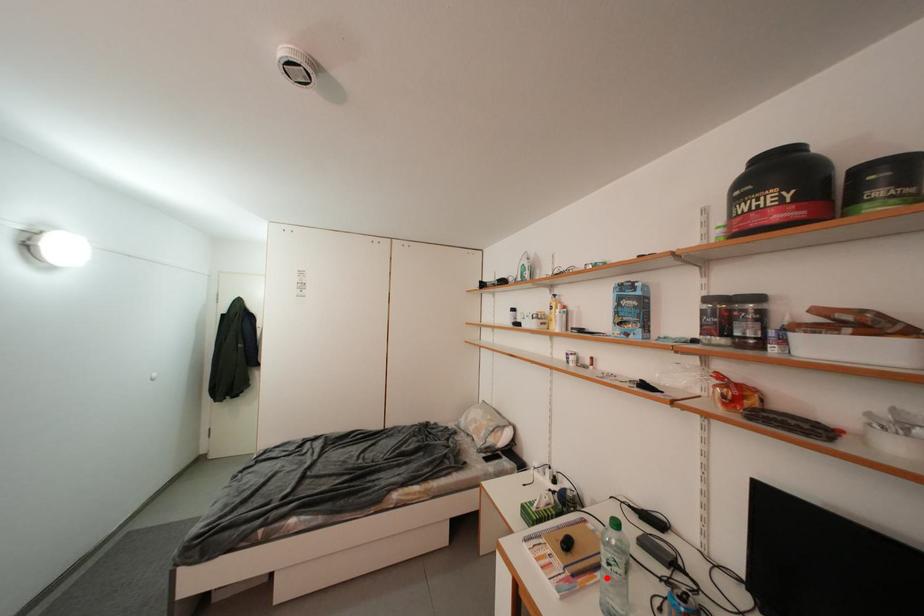
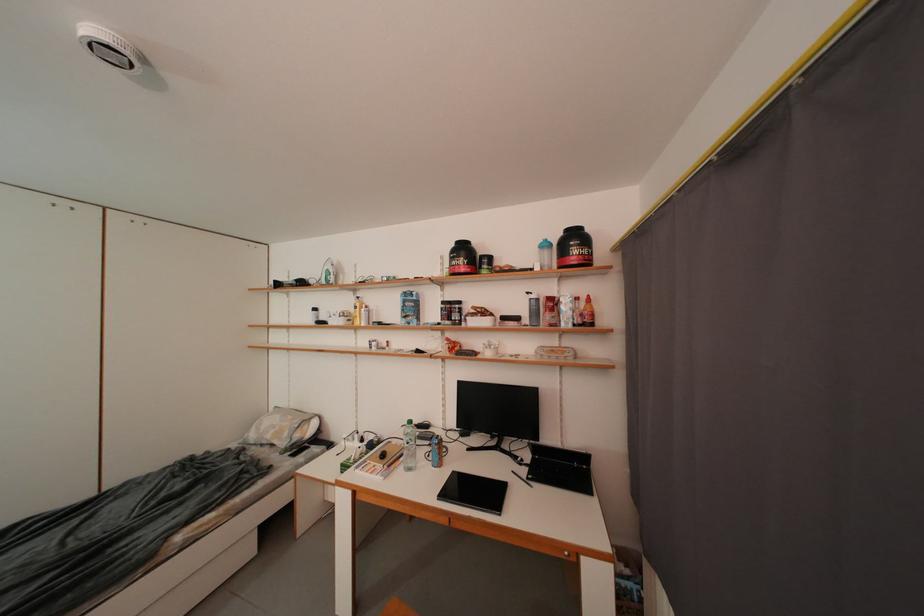
In the second image, find the point that corresponds to the highlighted location in the first image.

(409, 462)